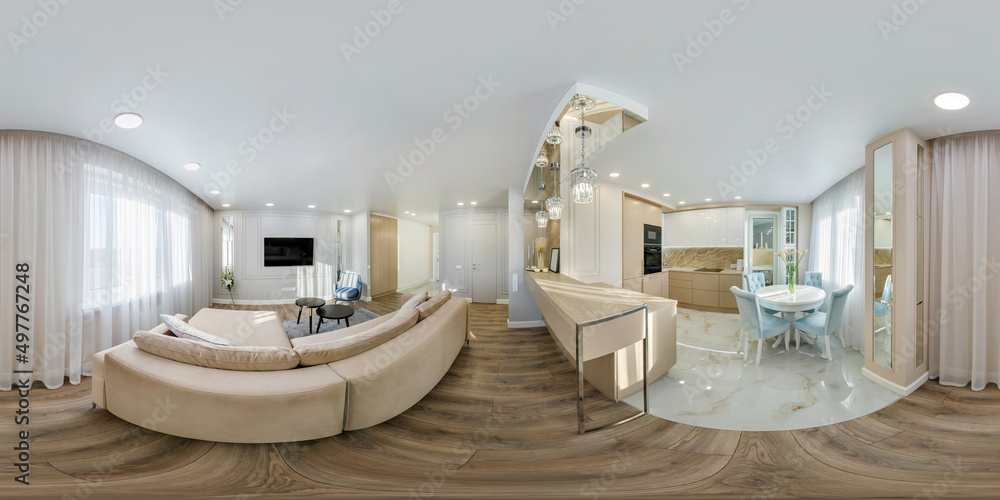
Locate an element on the screen. The image size is (1000, 500). tv is located at coordinates (278, 255).